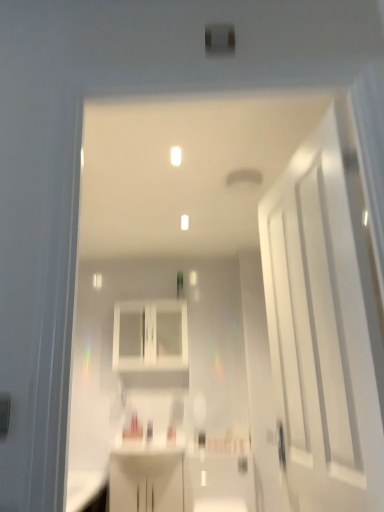
Question: Is white glossy door at right taller or shorter than white glossy cabinet at center?

Choices:
 (A) tall
 (B) short

Answer: (A)

Question: Is white glossy door at right spatially inside white glossy cabinet at center, or outside of it?

Choices:
 (A) inside
 (B) outside

Answer: (B)

Question: Is white glossy door at right wider or thinner than white glossy cabinet at center?

Choices:
 (A) thin
 (B) wide

Answer: (A)

Question: From the image's perspective, is white glossy cabinet at center located above or below white glossy door at right?

Choices:
 (A) below
 (B) above

Answer: (A)

Question: Does point (170, 330) appear closer or farther from the camera than point (319, 498)?

Choices:
 (A) farther
 (B) closer

Answer: (A)

Question: Based on their positions, is white glossy cabinet at center located to the left or right of white glossy door at right?

Choices:
 (A) left
 (B) right

Answer: (A)

Question: Is white glossy cabinet at center in front of or behind white glossy door at right in the image?

Choices:
 (A) behind
 (B) front

Answer: (A)